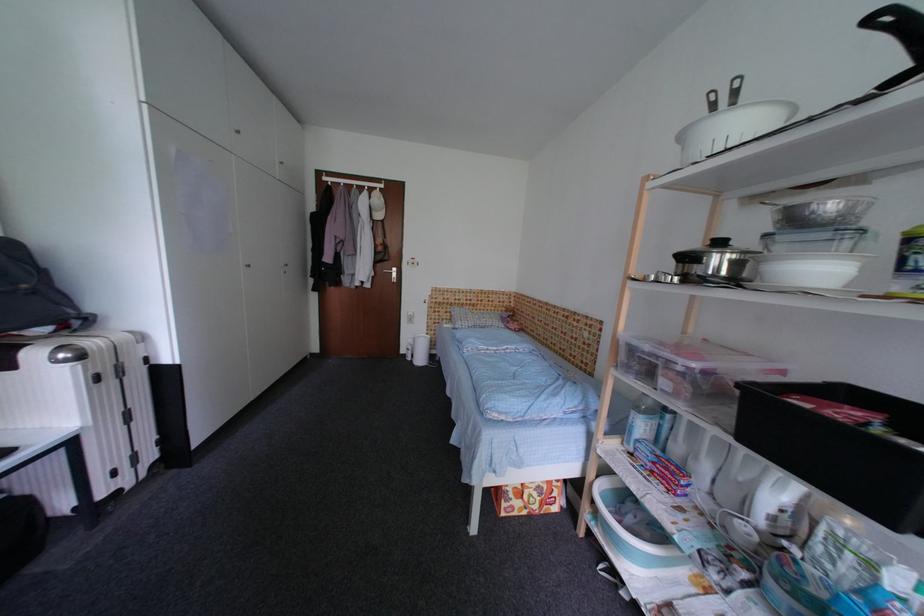
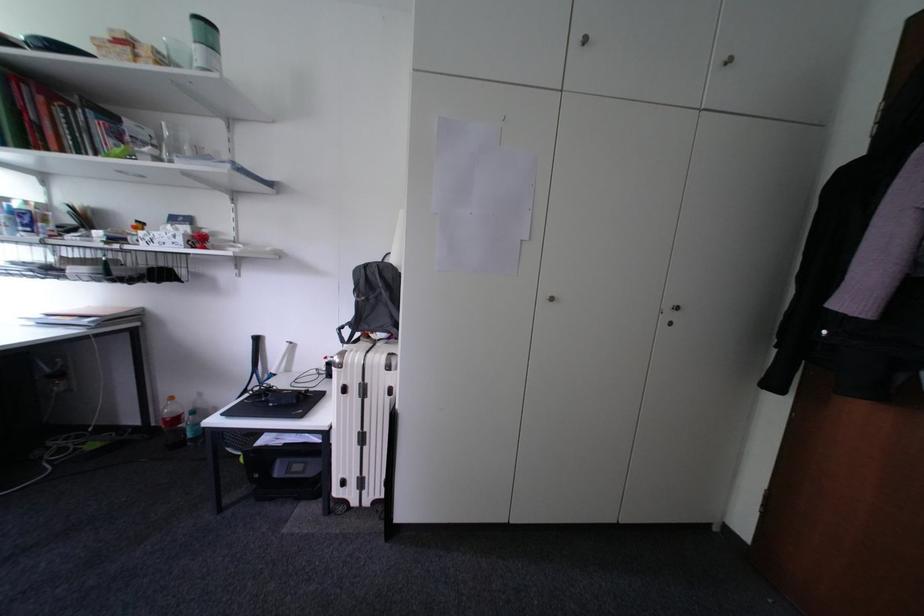
In the second image, find the point that corresponds to [104,381] in the first image.

(353, 392)